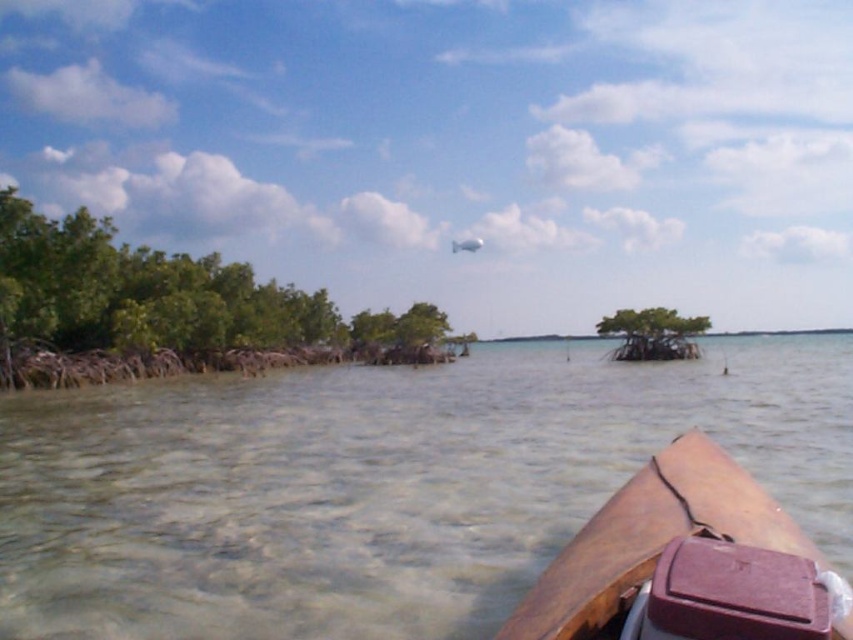
Is clear water at lower center smaller than brown leather boat at lower right?

Actually, clear water at lower center might be larger than brown leather boat at lower right.

Can you confirm if clear water at lower center is wider than brown leather boat at lower right?

Indeed, clear water at lower center has a greater width compared to brown leather boat at lower right.

From the picture: Who is more forward, [183,416] or [741,468]?

Point [741,468] is in front.

Where is `clear water at lower center`? clear water at lower center is located at coordinates (379, 484).